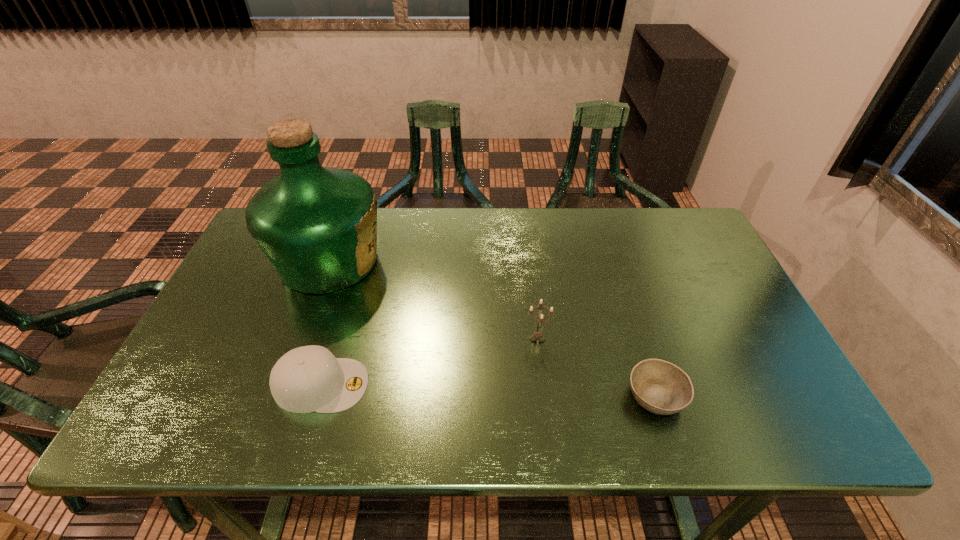
Identify the location of free spot between the shortest object and the second farthest object. This screenshot has height=540, width=960. (596, 368).

What are the coordinates of `free spot between the third nearest object and the tallest object` in the screenshot? It's located at (433, 300).

I want to click on empty location between the bowl and the tallest object, so click(x=492, y=328).

Find the location of a particular element. The image size is (960, 540). object that ranks as the third closest to the liquor is located at coordinates (660, 387).

Choose which object is the second nearest neighbor to the second farthest object. Please provide its 2D coordinates. Your answer should be formatted as a tuple, i.e. [(x, y)], where the tuple contains the x and y coordinates of a point satisfying the conditions above.

[(309, 378)]

You are a GUI agent. You are given a task and a screenshot of the screen. Output one action in this format:
    pyautogui.click(x=<x>, y=<y>)
    Task: Click on the free spot that satisfies the following two spatial constraints: 1. on the front-facing side of the cap; 2. on the right side of the shortest object
    The width and height of the screenshot is (960, 540).
    Given the screenshot: What is the action you would take?
    pyautogui.click(x=318, y=396)

I want to click on vacant point that satisfies the following two spatial constraints: 1. on the front side of the candle holder; 2. on the left side of the rightmost object, so click(544, 396).

At what (x,y) coordinates should I click in order to perform the action: click on free region that satisfies the following two spatial constraints: 1. on the label side of the liquor; 2. on the back side of the second object from right to left. Please return your answer as a coordinate pair (x, y). Looking at the image, I should click on (300, 339).

You are a GUI agent. You are given a task and a screenshot of the screen. Output one action in this format:
    pyautogui.click(x=<x>, y=<y>)
    Task: Click on the vacant space that satisfies the following two spatial constraints: 1. on the label side of the second tallest object; 2. on the right side of the farthest object
    The image size is (960, 540).
    Given the screenshot: What is the action you would take?
    pyautogui.click(x=300, y=339)

At what (x,y) coordinates should I click in order to perform the action: click on vacant space that satisfies the following two spatial constraints: 1. on the front-facing side of the second shortest object; 2. on the right side of the rightmost object. Please return your answer as a coordinate pair (x, y). Image resolution: width=960 pixels, height=540 pixels. Looking at the image, I should click on (318, 396).